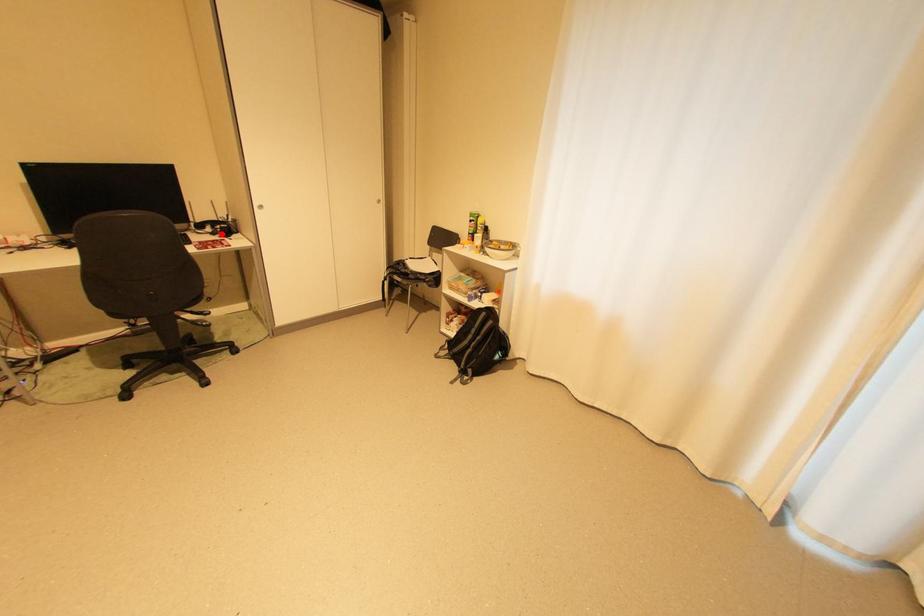
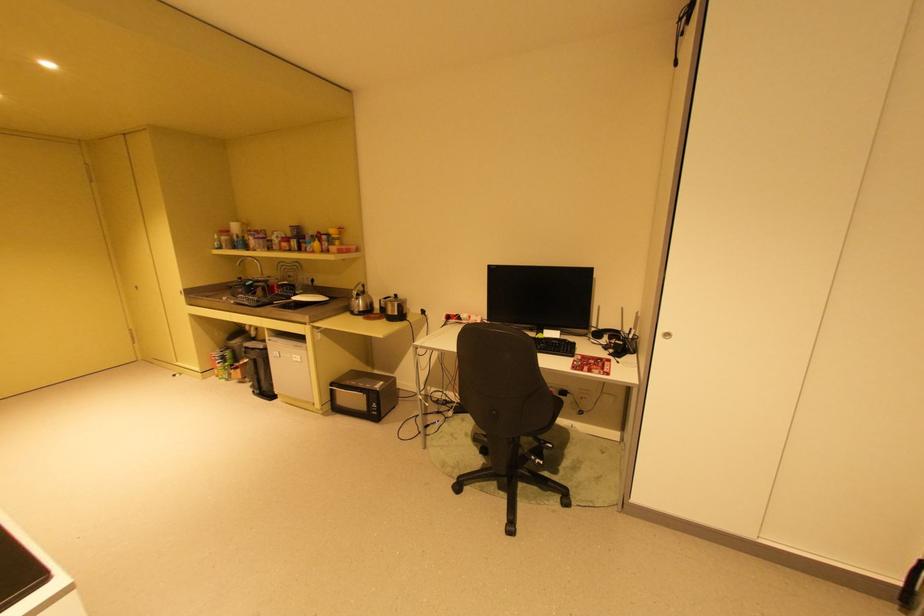
Locate, in the second image, the point that corresponds to the highlighted location in the first image.

(614, 349)